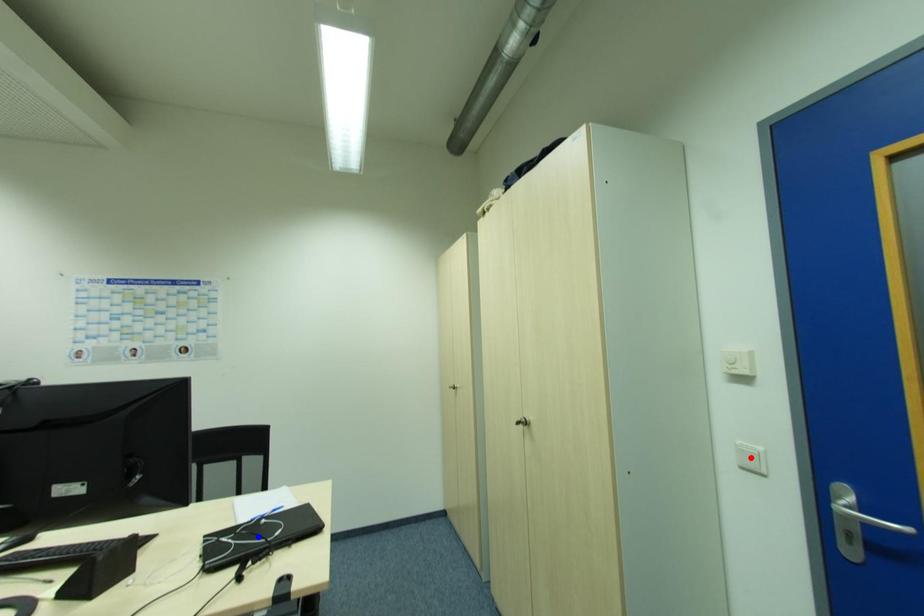
Question: Two points are marked on the image. Which point is closer to the camera?

Choices:
 (A) Blue point is closer.
 (B) Red point is closer.

Answer: (B)